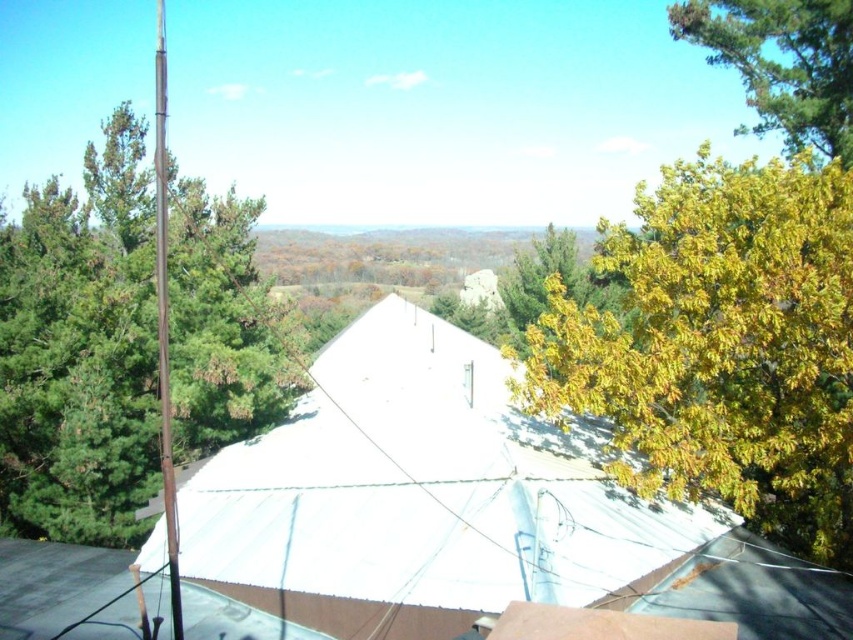
Question: Is yellow-green leaves at right above green pine tree at left?

Choices:
 (A) yes
 (B) no

Answer: (B)

Question: Which is farther from the green leafy tree at upper right?

Choices:
 (A) green pine tree at left
 (B) yellow-green leaves at right

Answer: (A)

Question: Does white matte canopy at center appear on the left side of metallic pole at left?

Choices:
 (A) yes
 (B) no

Answer: (B)

Question: Which of the following is the farthest from the observer?

Choices:
 (A) (62, 404)
 (B) (675, 33)
 (C) (160, 218)

Answer: (B)

Question: In this image, where is white matte canopy at center located relative to yellow-green leaves at right?

Choices:
 (A) right
 (B) left

Answer: (B)

Question: Which point is farther to the camera?

Choices:
 (A) (521, 472)
 (B) (840, 208)
 (C) (672, 4)
 (D) (86, 172)

Answer: (C)